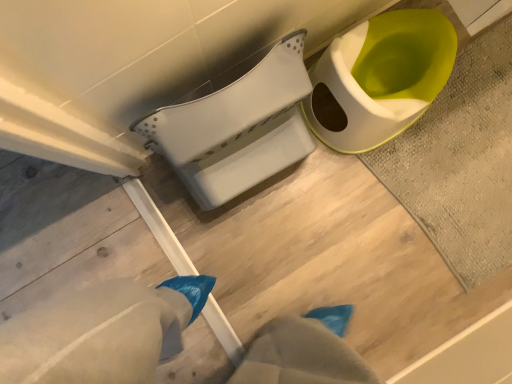
Question: Can you confirm if white plastic toilet at center, arranged as the 1th toilet when viewed from the left, is taller than textured gray bath mat at upper right?

Choices:
 (A) yes
 (B) no

Answer: (A)

Question: Is textured gray bath mat at upper right located within white plastic toilet at center, arranged as the 1th toilet when viewed from the left?

Choices:
 (A) yes
 (B) no

Answer: (B)

Question: From a real-world perspective, is white plastic toilet at center, arranged as the 1th toilet when viewed from the left, located higher than textured gray bath mat at upper right?

Choices:
 (A) no
 (B) yes

Answer: (B)

Question: From the image's perspective, is white plastic toilet at center, which ranks as the second toilet in right-to-left order, under textured gray bath mat at upper right?

Choices:
 (A) no
 (B) yes

Answer: (A)

Question: Can you confirm if white plastic toilet at center, which ranks as the second toilet in right-to-left order, is shorter than textured gray bath mat at upper right?

Choices:
 (A) no
 (B) yes

Answer: (A)

Question: From the image's perspective, is textured gray bath mat at upper right positioned above or below white plastic toilet at center, arranged as the 1th toilet when viewed from the left?

Choices:
 (A) below
 (B) above

Answer: (A)

Question: Relative to white plastic toilet at center, which ranks as the second toilet in right-to-left order, is textured gray bath mat at upper right in front or behind?

Choices:
 (A) behind
 (B) front

Answer: (A)

Question: From a real-world perspective, relative to white plastic toilet at center, which ranks as the second toilet in right-to-left order, is textured gray bath mat at upper right vertically above or below?

Choices:
 (A) above
 (B) below

Answer: (B)

Question: Which is correct: textured gray bath mat at upper right is inside white plastic toilet at center, arranged as the 1th toilet when viewed from the left, or outside of it?

Choices:
 (A) outside
 (B) inside

Answer: (A)

Question: Considering the positions of white plastic toilet at center, arranged as the 1th toilet when viewed from the left, and matte white toilet at upper right, the second toilet in the left-to-right sequence, in the image, is white plastic toilet at center, arranged as the 1th toilet when viewed from the left, taller or shorter than matte white toilet at upper right, the second toilet in the left-to-right sequence,?

Choices:
 (A) tall
 (B) short

Answer: (A)

Question: Considering their positions, is white plastic toilet at center, which ranks as the second toilet in right-to-left order, located in front of or behind matte white toilet at upper right, which is counted as the 1th toilet, starting from the right?

Choices:
 (A) behind
 (B) front

Answer: (B)

Question: From the image's perspective, is white plastic toilet at center, arranged as the 1th toilet when viewed from the left, positioned above or below matte white toilet at upper right, the second toilet in the left-to-right sequence?

Choices:
 (A) above
 (B) below

Answer: (B)

Question: Is white plastic toilet at center, arranged as the 1th toilet when viewed from the left, bigger or smaller than matte white toilet at upper right, the second toilet in the left-to-right sequence?

Choices:
 (A) small
 (B) big

Answer: (B)

Question: Is matte white toilet at upper right, the second toilet in the left-to-right sequence, in front of or behind textured gray bath mat at upper right in the image?

Choices:
 (A) front
 (B) behind

Answer: (A)

Question: From a real-world perspective, is matte white toilet at upper right, which is counted as the 1th toilet, starting from the right, physically located above or below textured gray bath mat at upper right?

Choices:
 (A) above
 (B) below

Answer: (A)